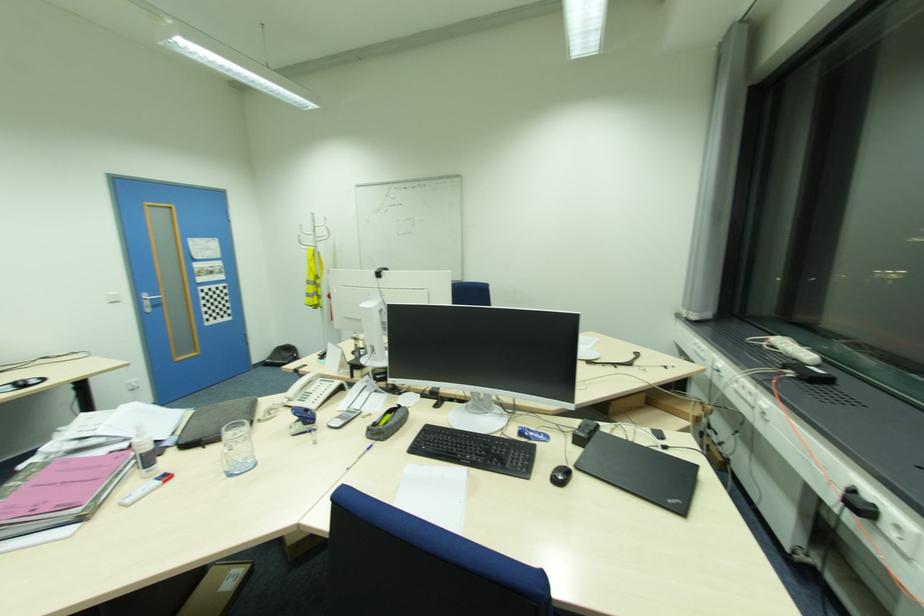
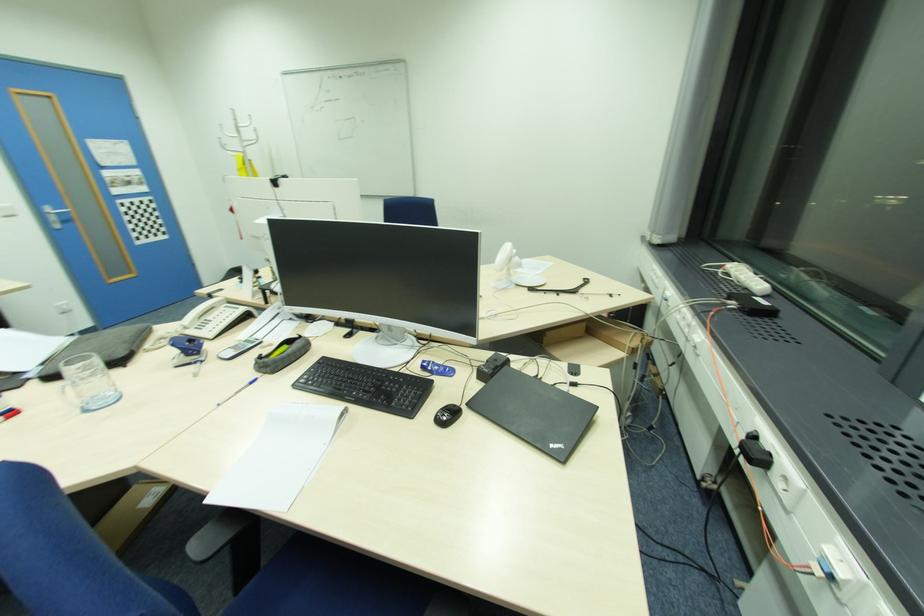
Locate, in the second image, the point that corresponds to pixel 227 475 in the first image.

(80, 413)